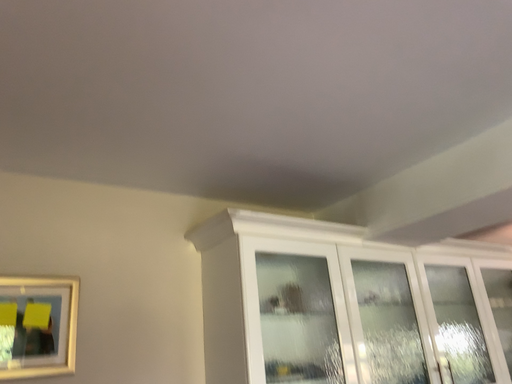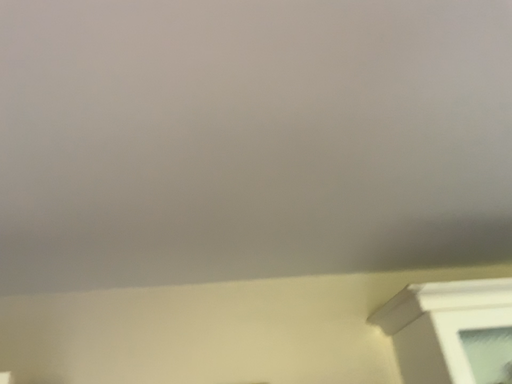
Question: Which way did the camera rotate in the video?

Choices:
 (A) rotated right
 (B) rotated left

Answer: (B)